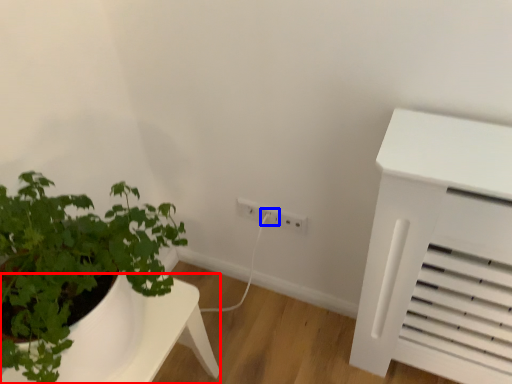
Question: Which of the following is the closest to the observer, table (highlighted by a red box) or electric outlet (highlighted by a blue box)?

Choices:
 (A) table
 (B) electric outlet

Answer: (A)